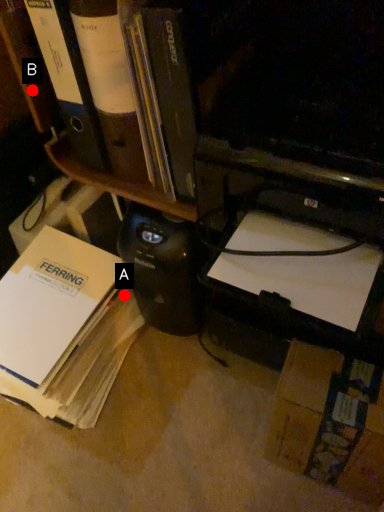
Question: Two points are circled on the image, labeled by A and B beside each circle. Which of the following is the closest to the observer?

Choices:
 (A) A is closer
 (B) B is closer

Answer: (B)